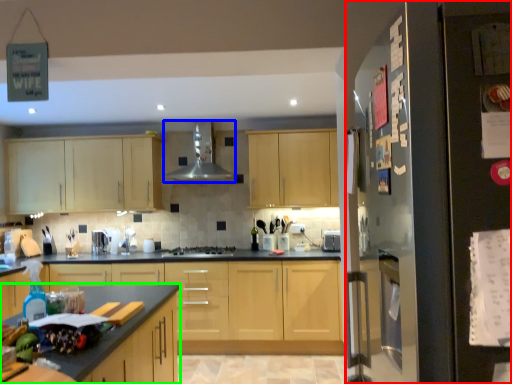
Question: Which object is positioned farthest from fridge (highlighted by a red box)? Select from exhaust hood (highlighted by a blue box) and countertop (highlighted by a green box).

Choices:
 (A) exhaust hood
 (B) countertop

Answer: (A)